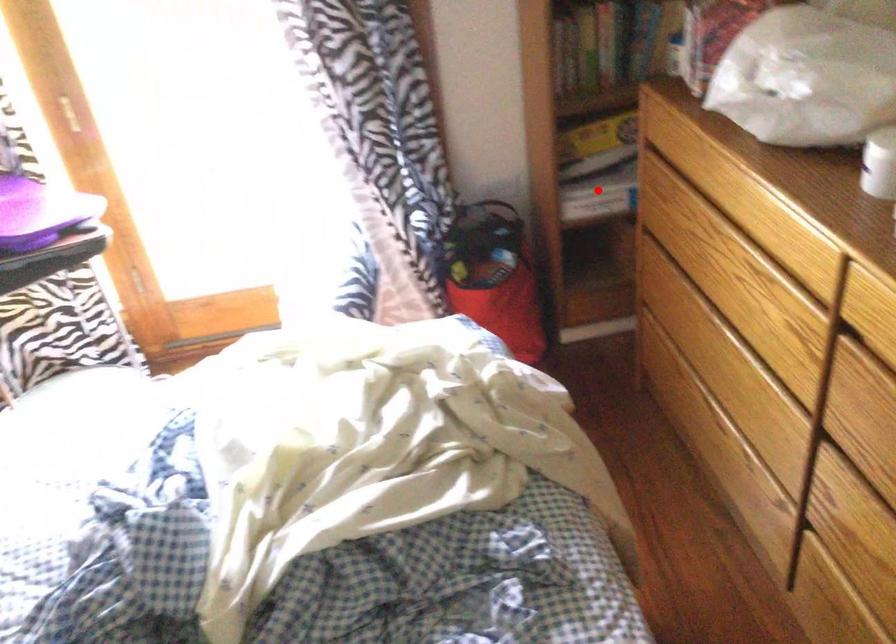
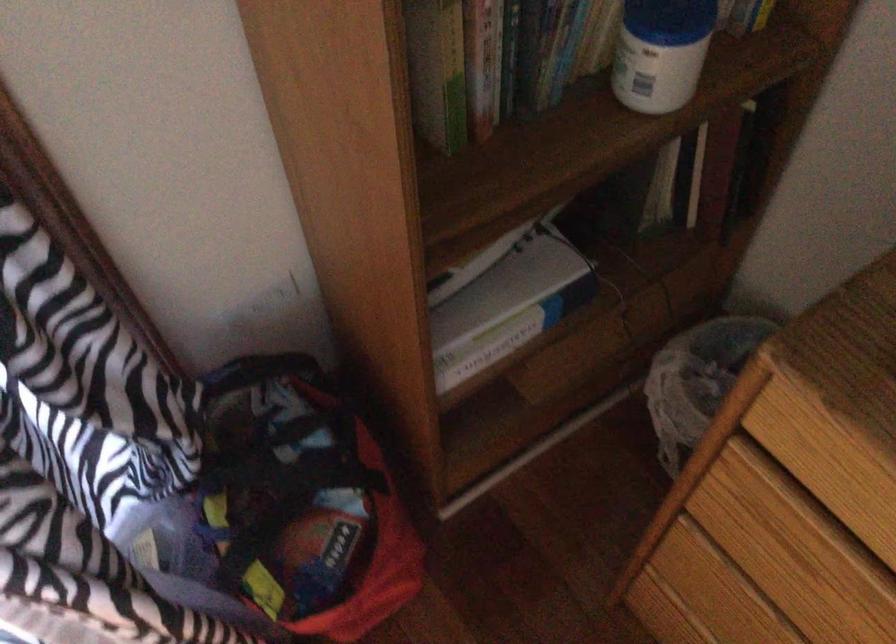
Question: A red point is marked in image1. In image2, is the corresponding 3D point closer to the camera or farther? Reply with the corresponding letter.

Choices:
 (A) The corresponding 3D point is closer.
 (B) The corresponding 3D point is farther.

Answer: (A)